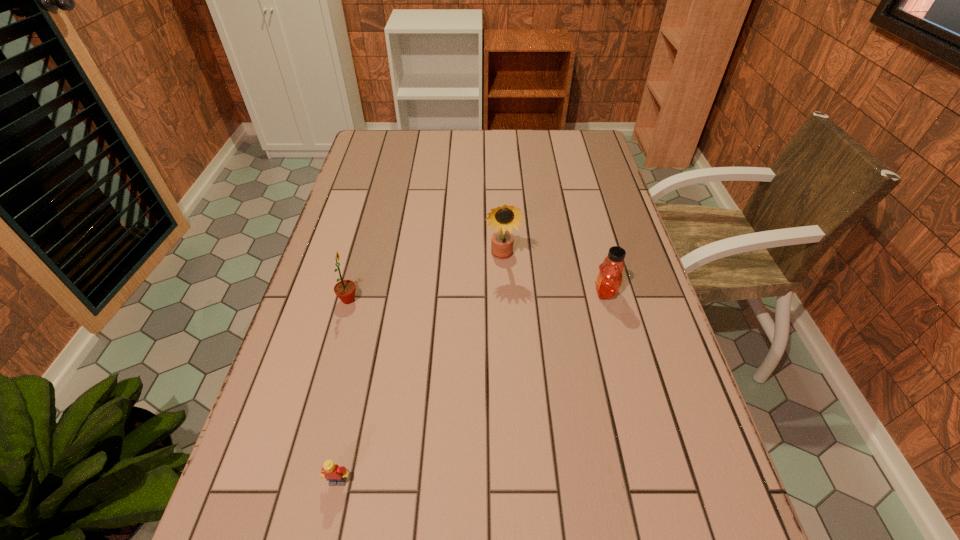
At what (x,y) coordinates should I click in order to perform the action: click on the farthest object. Please return your answer as a coordinate pair (x, y). The image size is (960, 540). Looking at the image, I should click on (503, 217).

Find the location of a particular element. the tallest object is located at coordinates (503, 217).

Where is `the nearer sunflower`? The height and width of the screenshot is (540, 960). the nearer sunflower is located at coordinates (345, 289).

You are a GUI agent. You are given a task and a screenshot of the screen. Output one action in this format:
    pyautogui.click(x=<x>, y=<y>)
    Task: Click on the leftmost object
    
    Given the screenshot: What is the action you would take?
    point(345,289)

You are a GUI agent. You are given a task and a screenshot of the screen. Output one action in this format:
    pyautogui.click(x=<x>, y=<y>)
    Task: Click on the rightmost object
    Image resolution: width=960 pixels, height=540 pixels.
    Given the screenshot: What is the action you would take?
    pyautogui.click(x=609, y=279)

The image size is (960, 540). What are the coordinates of `honey` in the screenshot? It's located at (609, 279).

Where is `the third object from right to left`? the third object from right to left is located at coordinates (336, 475).

This screenshot has width=960, height=540. What are the coordinates of `the shortest object` in the screenshot? It's located at (336, 475).

This screenshot has height=540, width=960. Identify the location of vacant region located on the face of the right sunflower. (508, 375).

Where is `blank area located 0.210m on the face of the nearer sunflower`? The height and width of the screenshot is (540, 960). blank area located 0.210m on the face of the nearer sunflower is located at coordinates (442, 300).